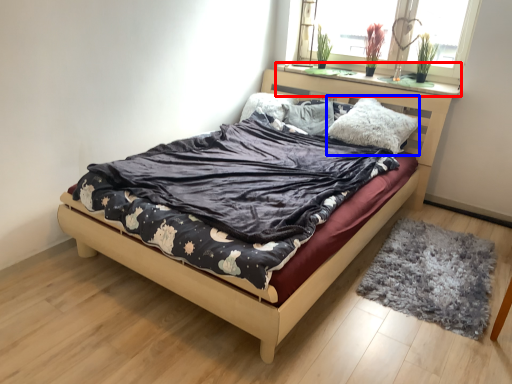
Question: Which point is closer to the camera, window sill (highlighted by a red box) or pillow (highlighted by a blue box)?

Choices:
 (A) window sill
 (B) pillow

Answer: (B)